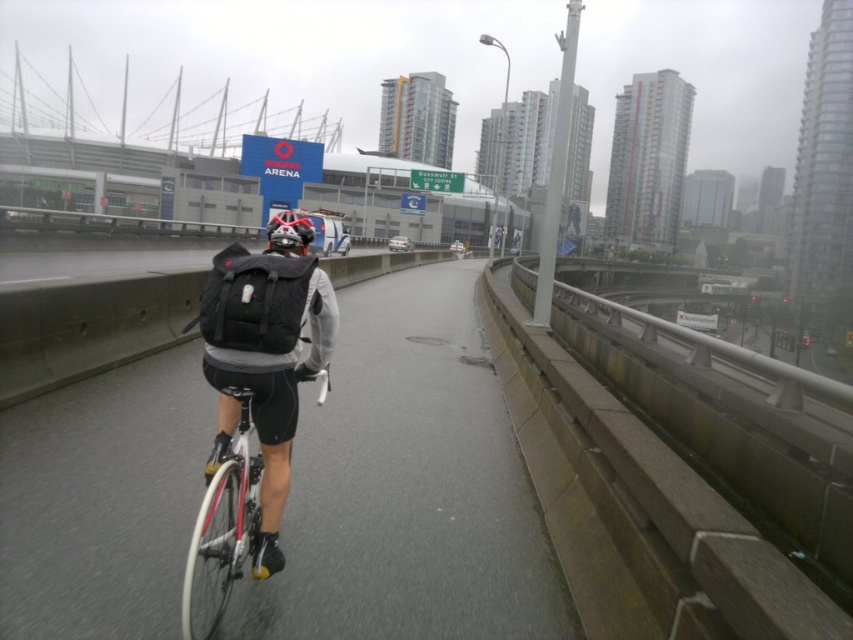
Between matte black backpack at center and shiny black helmet at center, which one appears on the right side from the viewer's perspective?

matte black backpack at center is more to the right.

Is matte black backpack at center above shiny black helmet at center?

Incorrect, matte black backpack at center is not positioned above shiny black helmet at center.

Where is `matte black backpack at center`? matte black backpack at center is located at coordinates (264, 362).

The height and width of the screenshot is (640, 853). What are the coordinates of `matte black backpack at center` in the screenshot? It's located at (264, 362).

Who is more forward, (231, 291) or (231, 477)?

Point (231, 291) is more forward.

Does point (303, 292) come closer to viewer compared to point (253, 460)?

Yes, point (303, 292) is in front of point (253, 460).

Who is more forward, (282, 509) or (209, 502)?

Point (209, 502) is in front.

I want to click on matte black backpack at center, so click(264, 362).

Does white asphalt road at center appear under matte black backpack at center?

Correct, white asphalt road at center is located below matte black backpack at center.

Is white asphalt road at center thinner than matte black backpack at center?

Incorrect, white asphalt road at center's width is not less than matte black backpack at center's.

Is point (120, 458) less distant than point (265, 544)?

No.

Where is `white asphalt road at center`? The image size is (853, 640). white asphalt road at center is located at coordinates (408, 486).